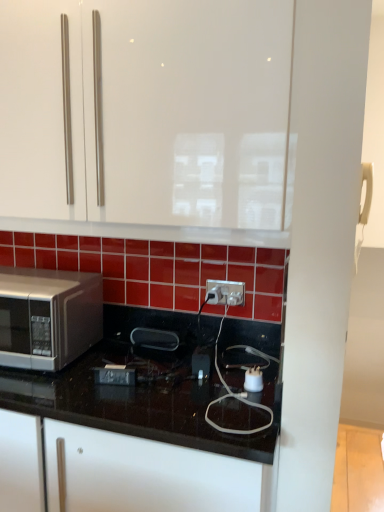
Question: From a real-world perspective, is white plastic electric outlet at center located higher than satin silver microwave at left?

Choices:
 (A) yes
 (B) no

Answer: (A)

Question: Is white plastic electric outlet at center shorter than satin silver microwave at left?

Choices:
 (A) no
 (B) yes

Answer: (B)

Question: Considering the relative sizes of white plastic electric outlet at center and satin silver microwave at left in the image provided, is white plastic electric outlet at center smaller than satin silver microwave at left?

Choices:
 (A) no
 (B) yes

Answer: (B)

Question: Are white plastic electric outlet at center and satin silver microwave at left far apart?

Choices:
 (A) no
 (B) yes

Answer: (A)

Question: From a real-world perspective, does white plastic electric outlet at center sit lower than satin silver microwave at left?

Choices:
 (A) yes
 (B) no

Answer: (B)

Question: Is white plastic electric outlet at center at the left side of satin silver microwave at left?

Choices:
 (A) no
 (B) yes

Answer: (A)

Question: Is the position of satin silver microwave at left more distant than that of black glossy countertop at lower left?

Choices:
 (A) no
 (B) yes

Answer: (B)

Question: Is satin silver microwave at left outside black glossy countertop at lower left?

Choices:
 (A) no
 (B) yes

Answer: (A)

Question: From a real-world perspective, is satin silver microwave at left below black glossy countertop at lower left?

Choices:
 (A) no
 (B) yes

Answer: (A)

Question: From the image's perspective, is satin silver microwave at left located above black glossy countertop at lower left?

Choices:
 (A) no
 (B) yes

Answer: (B)

Question: Is satin silver microwave at left to the right of black glossy countertop at lower left from the viewer's perspective?

Choices:
 (A) yes
 (B) no

Answer: (B)

Question: Is satin silver microwave at left facing away from black glossy countertop at lower left?

Choices:
 (A) yes
 (B) no

Answer: (B)

Question: Can you confirm if white glossy cabinet at upper center is bigger than white plastic electric outlet at center?

Choices:
 (A) no
 (B) yes

Answer: (B)